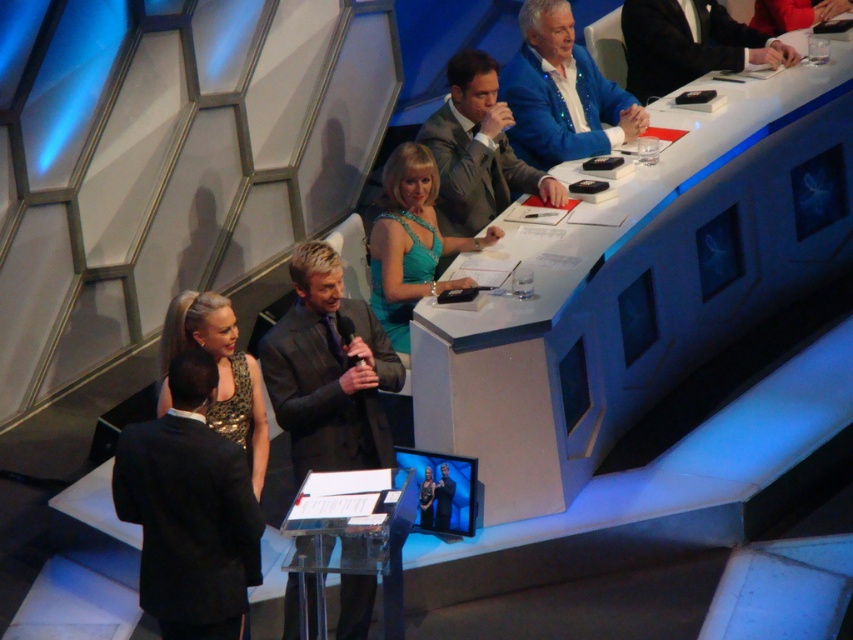
Question: Does matte gray suit at center have a smaller size compared to black silk business suit at upper right?

Choices:
 (A) no
 (B) yes

Answer: (A)

Question: Which point is farther from the camera taking this photo?

Choices:
 (A) (747, 48)
 (B) (592, 120)
 (C) (315, 424)
 (D) (144, 512)

Answer: (A)

Question: Where is white plastic table at center located in relation to black satin suit at lower left in the image?

Choices:
 (A) above
 (B) below

Answer: (A)

Question: Is blue velvet jacket at upper center wider than gold sequined dress at lower left?

Choices:
 (A) no
 (B) yes

Answer: (B)

Question: Which object appears closest to the camera in this image?

Choices:
 (A) black silk business suit at upper right
 (B) blue velvet jacket at upper center
 (C) black satin suit at lower left
 (D) gold sequined dress at lower left

Answer: (C)

Question: Which point is closer to the camera?

Choices:
 (A) click(x=221, y=378)
 (B) click(x=456, y=173)

Answer: (A)